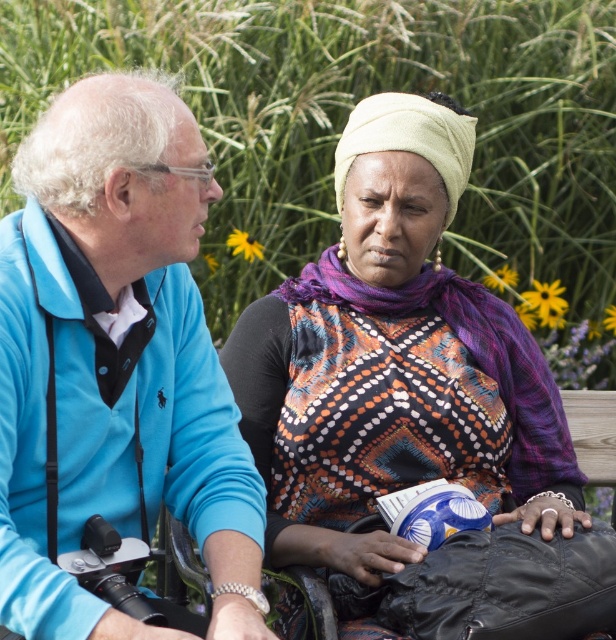
Based on the photo, you are organizing a fashion show and need to arrange the blue velvety cardigan at left and the patterned fabric scarf at center based on their height. Which item should be placed first if you are arranging them from shortest to tallest?

The blue velvety cardigan at left should be placed first because it is shorter than the patterned fabric scarf at center.